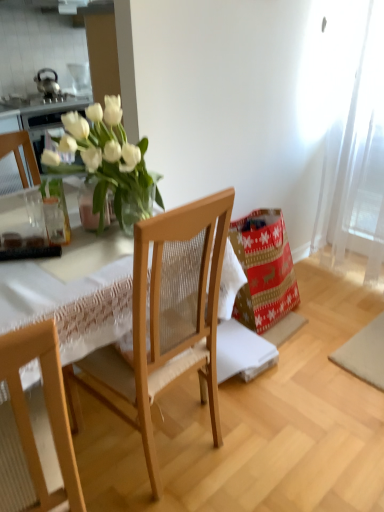
You are a GUI agent. You are given a task and a screenshot of the screen. Output one action in this format:
    pyautogui.click(x=<x>, y=<y>)
    Task: Click on the vacant area that is situated to the right of wooden chair at center
    The width and height of the screenshot is (384, 512).
    Given the screenshot: What is the action you would take?
    pyautogui.click(x=254, y=439)